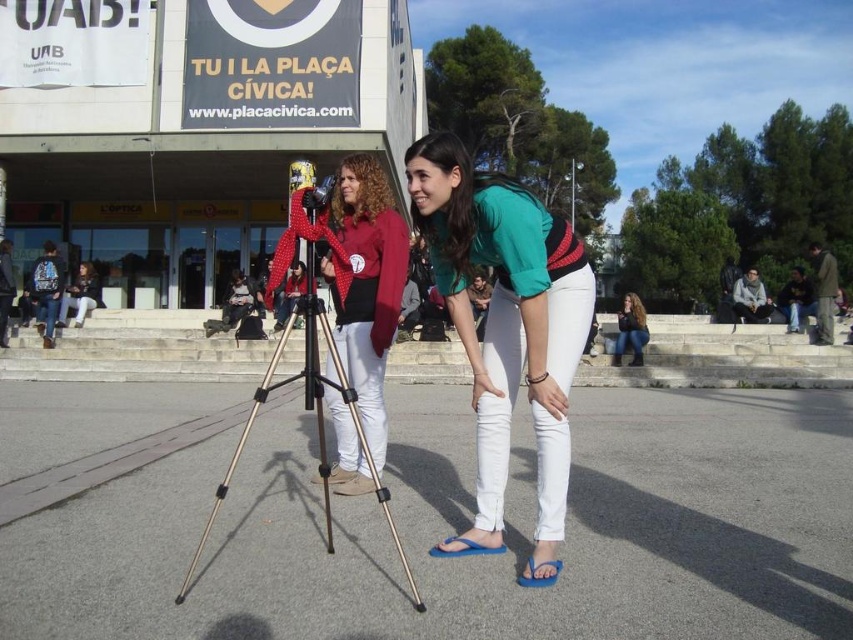
In the scene shown: You are a photographer needing to set up a camera on a tripod. The black metallic tripod at center is in your way. Can you move it to the side without moving the matte black jacket at lower left?

The black metallic tripod at center is wider than the matte black jacket at lower left, so it can be moved aside without disturbing the jacket as long as there is enough space to accommodate its larger width.

You are a photographer adjusting your camera settings. You notice two points in the scene at coordinates point (325,269) and point (302,209). Which point is closer to the camera?

Point (302,209) is closer to the camera than point (325,269) because the latter is further away according to their depth positions.

You are a photographer preparing to take a photo of the matte red shirt at center and the black metallic tripod at center. Which object should you focus on first if you want to capture both in sharp detail?

The matte red shirt at center is smaller than the black metallic tripod at center, so you should focus on the black metallic tripod at center first to ensure both are in sharp detail.